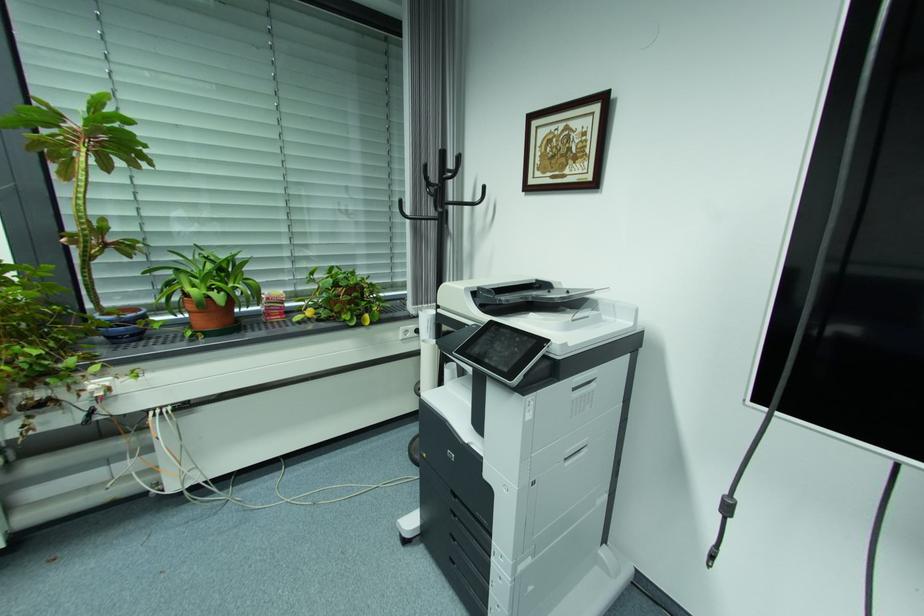
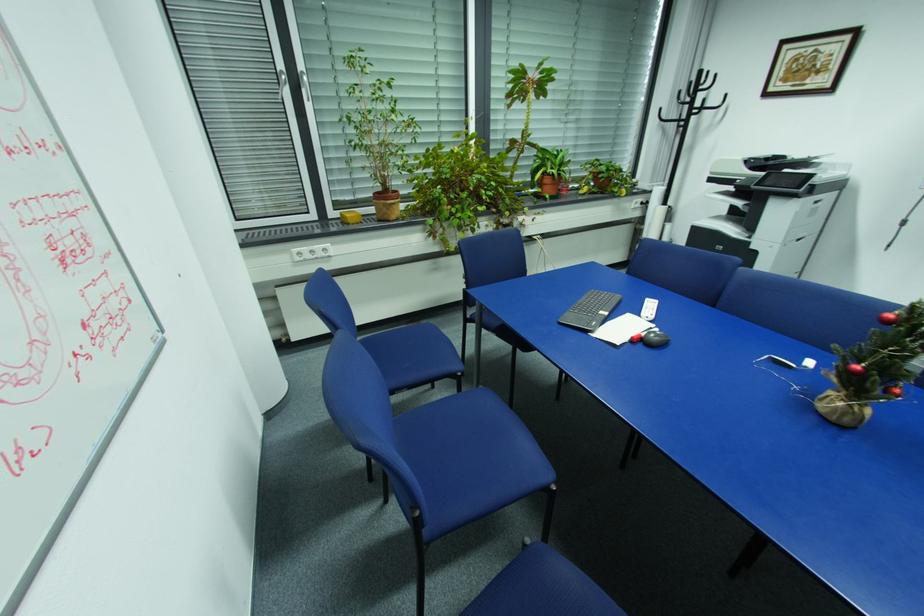
The images are taken continuously from a first-person perspective. In which direction are you moving?

The movement direction of the cameraman is left, backward.